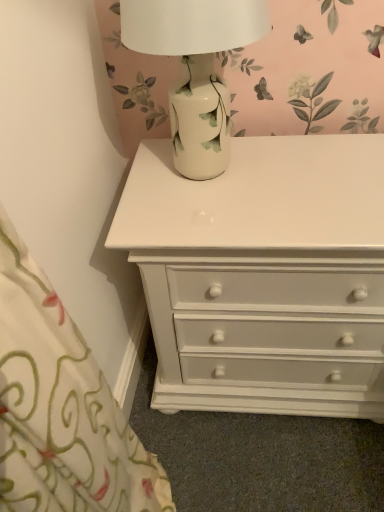
Question: Is porcelain vase at upper center wider or thinner than white glossy chest of drawers at center?

Choices:
 (A) thin
 (B) wide

Answer: (A)

Question: Is porcelain vase at upper center in front of or behind white glossy chest of drawers at center in the image?

Choices:
 (A) front
 (B) behind

Answer: (A)

Question: Is point (175, 34) positioned closer to the camera than point (279, 292)?

Choices:
 (A) farther
 (B) closer

Answer: (B)

Question: From their relative heights in the image, would you say white glossy chest of drawers at center is taller or shorter than porcelain vase at upper center?

Choices:
 (A) tall
 (B) short

Answer: (A)

Question: Is white glossy chest of drawers at center in front of or behind porcelain vase at upper center in the image?

Choices:
 (A) front
 (B) behind

Answer: (B)

Question: Is white glossy chest of drawers at center to the left or to the right of porcelain vase at upper center in the image?

Choices:
 (A) left
 (B) right

Answer: (B)

Question: Does point (291, 186) appear closer or farther from the camera than point (167, 53)?

Choices:
 (A) closer
 (B) farther

Answer: (B)